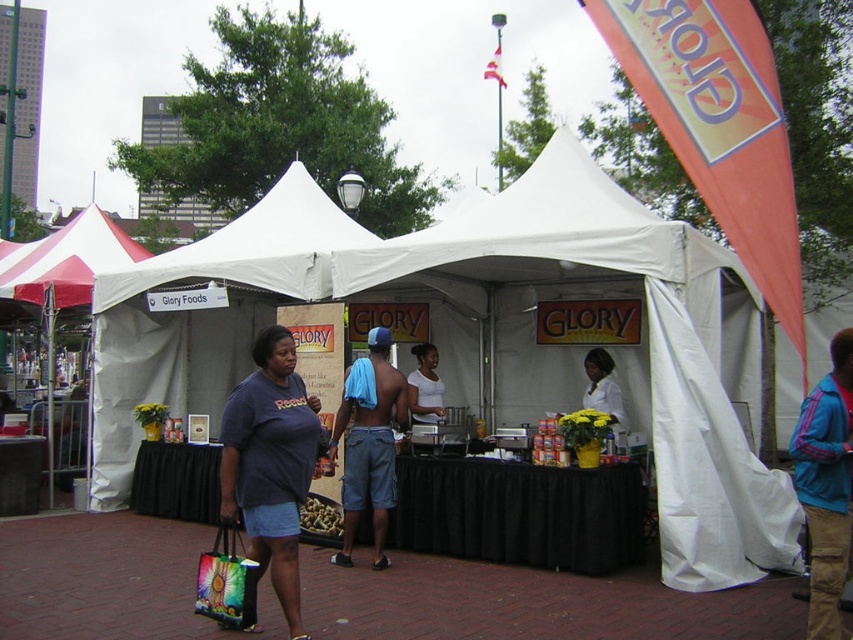
What is located at the coordinates point (488, 337) in the image?

The white fabric tent at center is located at point (488, 337).

You are a photographer at the market and want to capture the white fabric tent at center and the blue fleece jacket at lower right in the same frame. Which object is wider so that it can be centered in the photo without cropping?

The white fabric tent at center is wider than the blue fleece jacket at lower right, so it should be centered in the photo to avoid cropping.